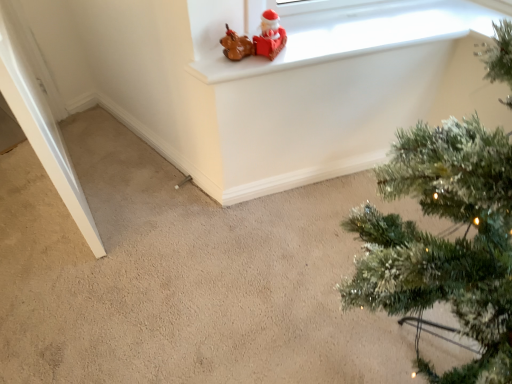
Question: Does point (264, 36) appear closer or farther from the camera than point (392, 216)?

Choices:
 (A) closer
 (B) farther

Answer: (B)

Question: In terms of width, does matte brown figurine at upper center look wider or thinner when compared to green textured christmas tree at upper right?

Choices:
 (A) wide
 (B) thin

Answer: (B)

Question: Which of these objects is positioned farthest from the matte brown figurine at upper center?

Choices:
 (A) green textured christmas tree at upper right
 (B) matte white window frame at upper center

Answer: (A)

Question: Which object is the closest to the matte brown figurine at upper center?

Choices:
 (A) green textured christmas tree at upper right
 (B) matte white window frame at upper center

Answer: (B)